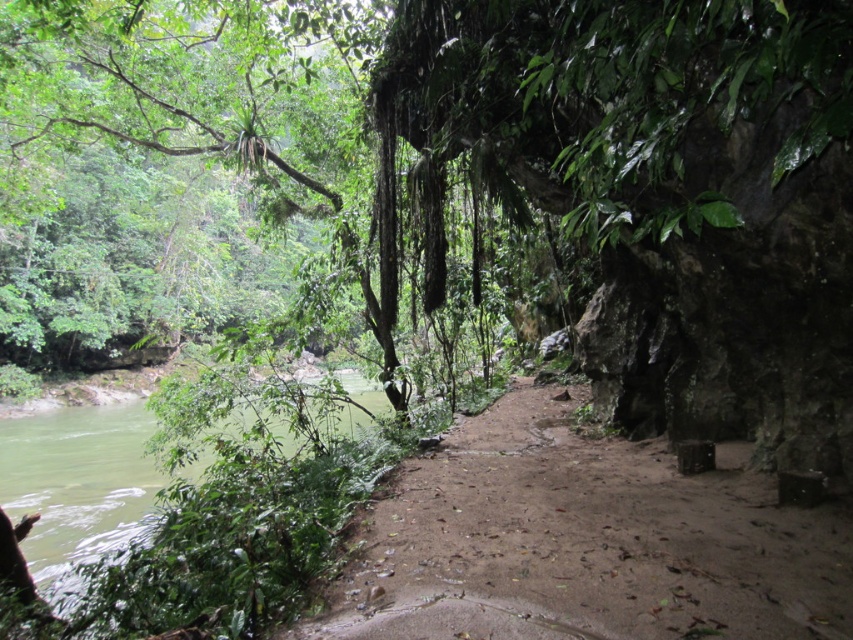
Is point (105, 156) positioned before point (543, 493)?

That is False.

Which is more to the left, green leafy tree at upper left or brown sandy dirt track at center?

green leafy tree at upper left

Which is in front, point (38, 68) or point (376, 541)?

Point (376, 541) is more forward.

Find the location of a particular element. The width and height of the screenshot is (853, 640). green leafy tree at upper left is located at coordinates (173, 164).